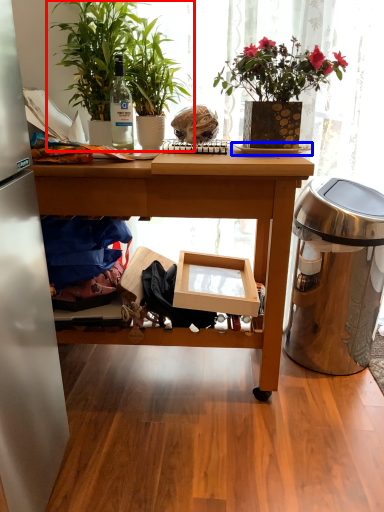
Question: Among these objects, which one is nearest to the camera, houseplant (highlighted by a red box) or plate (highlighted by a blue box)?

Choices:
 (A) houseplant
 (B) plate

Answer: (A)